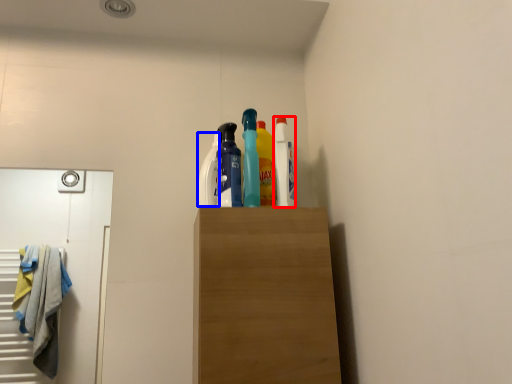
Question: Which object appears farthest to the camera in this image, cleaning product (highlighted by a red box) or cleaning product (highlighted by a blue box)?

Choices:
 (A) cleaning product
 (B) cleaning product

Answer: (B)